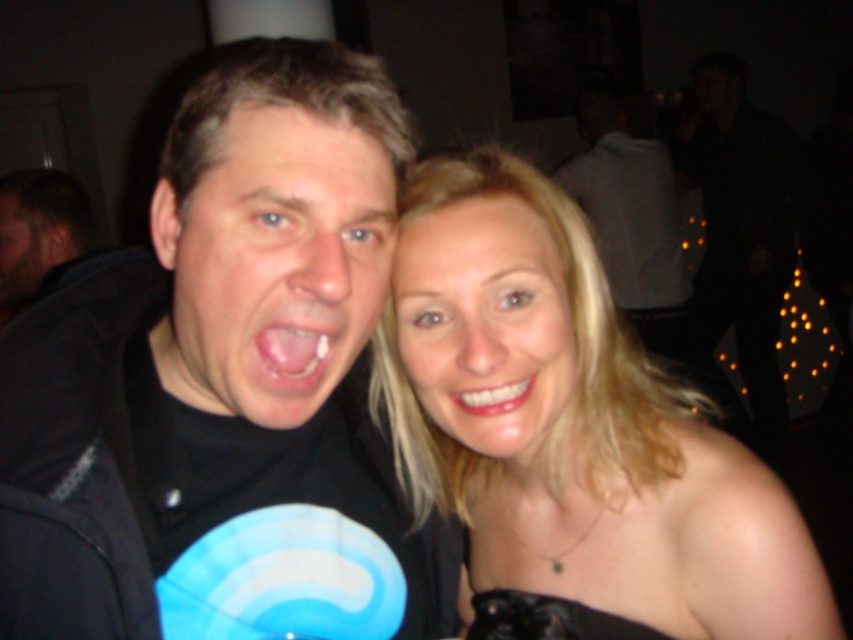
Is blonde hair at upper right thinner than dark brown hair at left?

In fact, blonde hair at upper right might be wider than dark brown hair at left.

Does blonde hair at upper right have a lesser height compared to dark brown hair at left?

No, blonde hair at upper right is not shorter than dark brown hair at left.

Identify the location of blonde hair at upper right. (572, 422).

I want to click on blonde hair at upper right, so click(572, 422).

Is blonde hair at upper right to the left of smooth skin face at center from the viewer's perspective?

Incorrect, blonde hair at upper right is not on the left side of smooth skin face at center.

Is point (811, 579) closer to camera compared to point (3, 298)?

Yes.

Where is `blonde hair at upper right`? blonde hair at upper right is located at coordinates (572, 422).

Can you confirm if smooth blonde hair at center is shorter than white matte shirt at upper center?

Indeed, smooth blonde hair at center has a lesser height compared to white matte shirt at upper center.

Is point (463, 401) farther from camera compared to point (604, 257)?

That is False.

Between point (566, 308) and point (612, 234), which one is positioned in front?

Point (566, 308)

The height and width of the screenshot is (640, 853). Find the location of `smooth blonde hair at center`. smooth blonde hair at center is located at coordinates (485, 324).